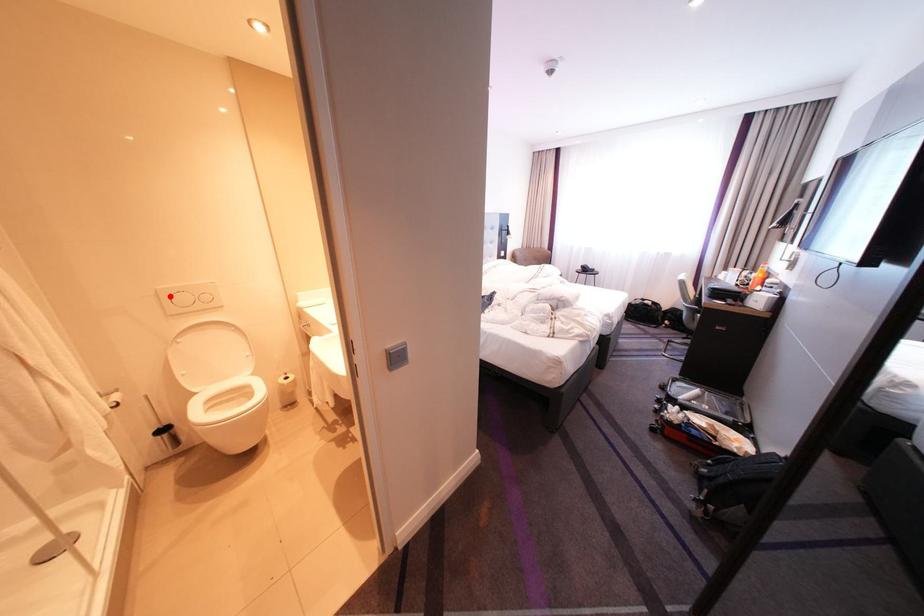
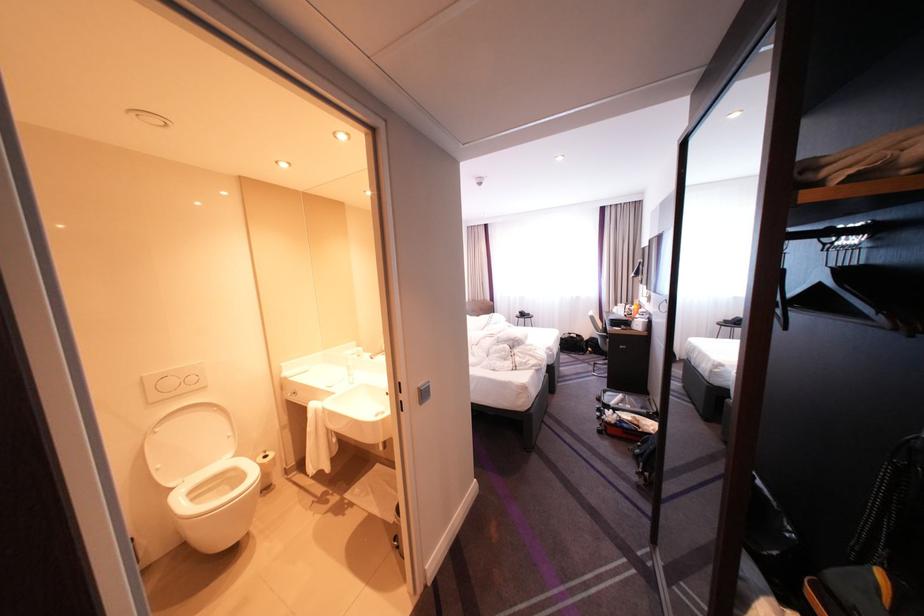
Where in the second image is the point corresponding to the highlighted location from the first image?

(154, 384)